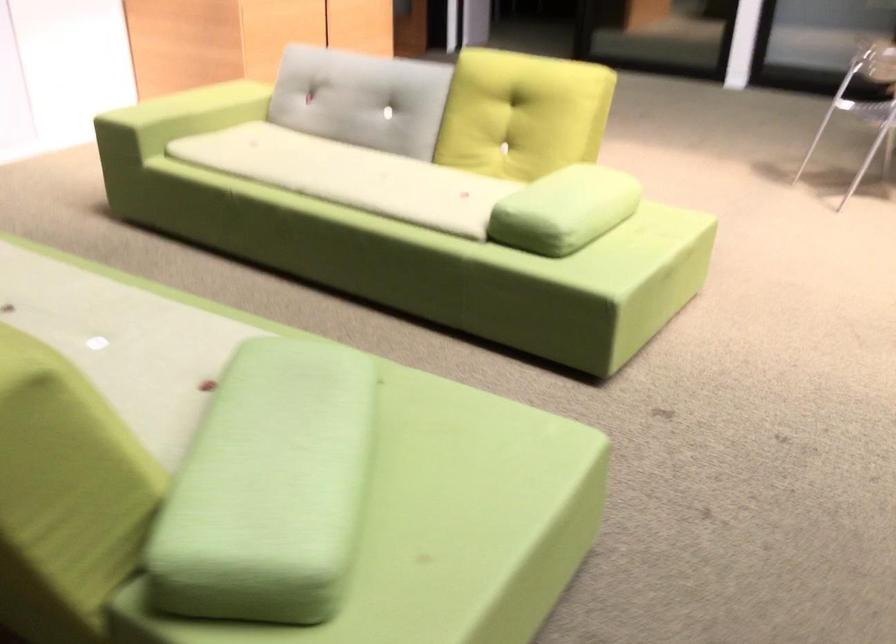
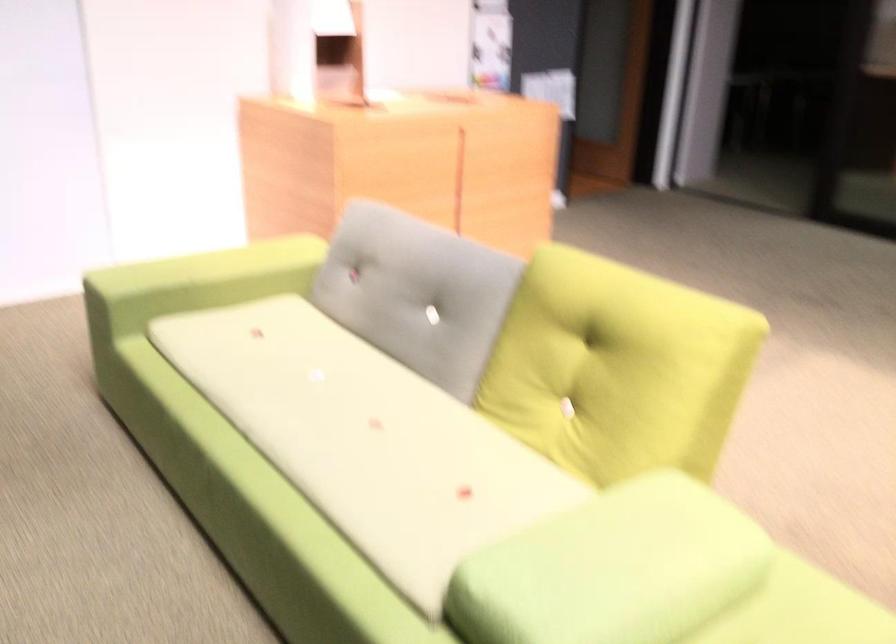
Locate, in the second image, the point that corresponds to (371,91) in the first image.

(417, 292)